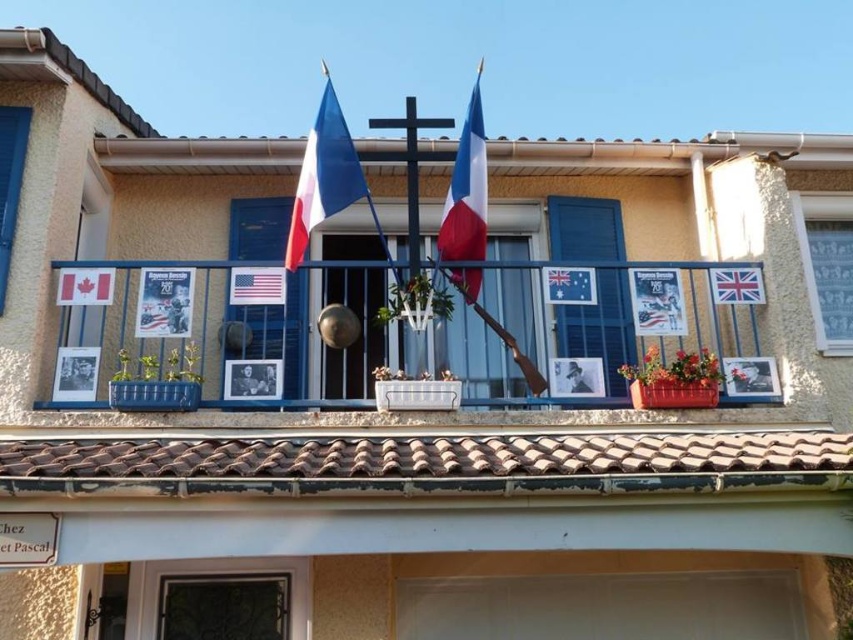
Is blue painted wood shutter at center positioned behind matte red flag at left?

That is True.

Who is more distant from viewer, (572, 337) or (62, 275)?

The point (572, 337) is behind.

Between point (581, 212) and point (111, 300), which one is positioned behind?

Point (581, 212)

At what (x,y) coordinates should I click in order to perform the action: click on blue painted wood shutter at center. Please return your answer as a coordinate pair (x, y). The height and width of the screenshot is (640, 853). Looking at the image, I should click on (601, 328).

Is metallic blue railing at center taller than matte fabric flag at upper center?

Incorrect, metallic blue railing at center's height is not larger of matte fabric flag at upper center's.

What do you see at coordinates (584, 321) in the screenshot? This screenshot has width=853, height=640. I see `metallic blue railing at center` at bounding box center [584, 321].

The width and height of the screenshot is (853, 640). I want to click on metallic blue railing at center, so click(584, 321).

Measure the distance from metallic blue railing at center to blue plastic shutter at upper left.

They are 2.47 meters apart.

Is point (67, 323) closer to viewer compared to point (3, 225)?

No, it is not.

The image size is (853, 640). I want to click on metallic blue railing at center, so click(x=584, y=321).